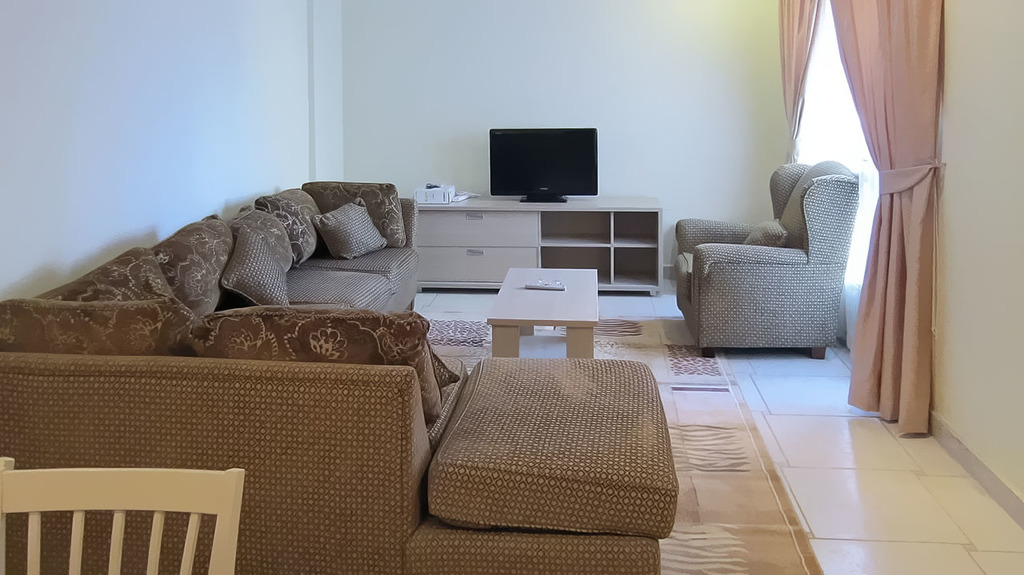
The image size is (1024, 575). In order to click on area carpet in this screenshot , I will do `click(762, 508)`, `click(693, 362)`.